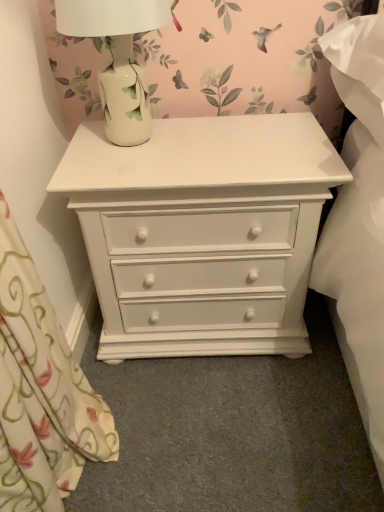
At what (x,y) coordinates should I click in order to perform the action: click on vacant region in front of white ceramic lamp at upper left. Please return your answer as a coordinate pair (x, y). This screenshot has width=384, height=512. Looking at the image, I should click on (137, 170).